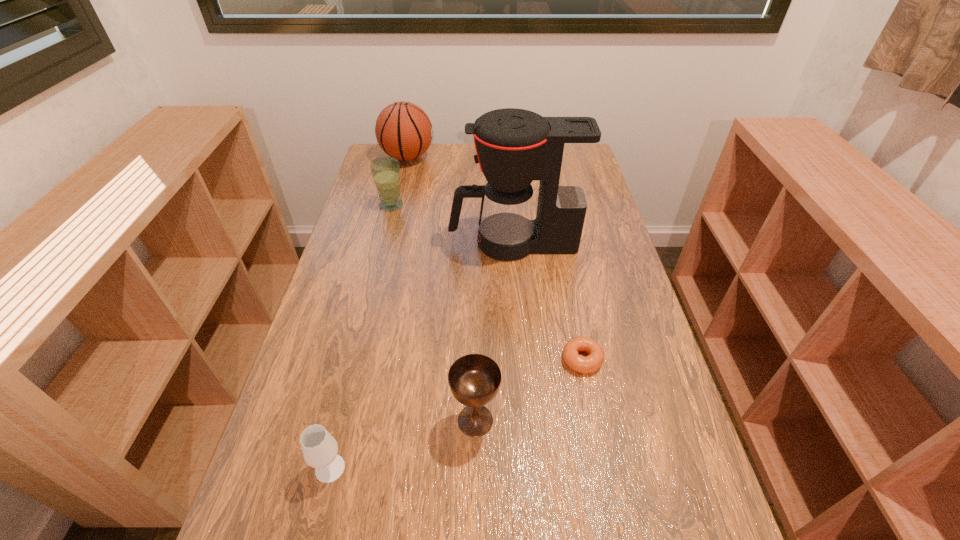
Find the location of a particular element. The image size is (960, 540). vacant position in the image that satisfies the following two spatial constraints: 1. on the side where the inflation valve is located; 2. on the front side of the taller glass is located at coordinates (396, 205).